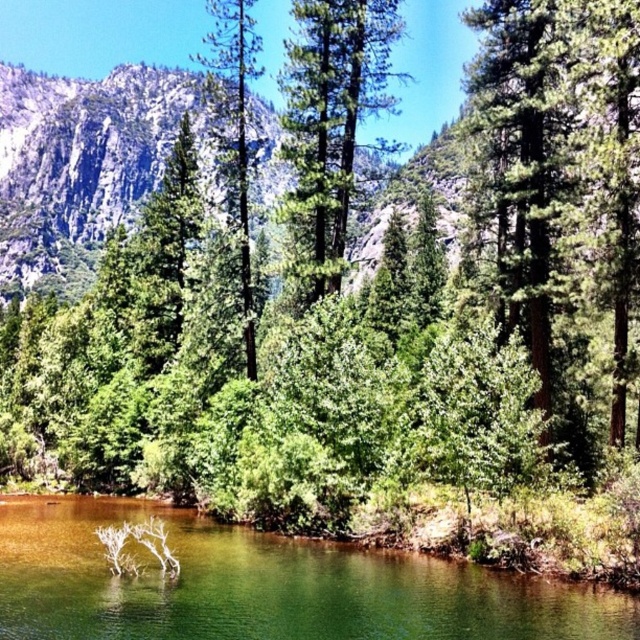
Question: Can you confirm if green glossy water at center is positioned above green textured pine tree at center?

Choices:
 (A) no
 (B) yes

Answer: (A)

Question: Which point is closer to the camera?

Choices:
 (A) green matte tree at center
 (B) green textured pine tree at center
 (C) green glossy water at center

Answer: (C)

Question: Is green glossy water at center above green matte tree at center?

Choices:
 (A) yes
 (B) no

Answer: (B)

Question: Does green glossy water at center appear on the left side of green textured pine tree at center?

Choices:
 (A) no
 (B) yes

Answer: (B)

Question: Which point is closer to the camera?

Choices:
 (A) green glossy water at center
 (B) green matte tree at center

Answer: (A)

Question: Which object is positioned farthest from the green glossy water at center?

Choices:
 (A) green textured pine tree at center
 (B) green matte tree at center

Answer: (B)